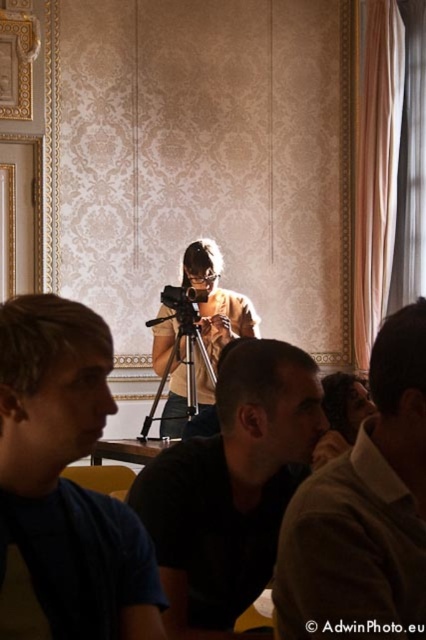
This screenshot has width=426, height=640. Find the location of `dark brown leather jacket at center`. dark brown leather jacket at center is located at coordinates (365, 512).

Does dark brown leather jacket at center lie in front of black plastic video camera at center?

Yes, dark brown leather jacket at center is in front of black plastic video camera at center.

This screenshot has width=426, height=640. Describe the element at coordinates (365, 512) in the screenshot. I see `dark brown leather jacket at center` at that location.

Find the location of a particular element. dark brown leather jacket at center is located at coordinates (365, 512).

Between blue cotton shirt at lower left and dark brown leather jacket at center, which one appears on the left side from the viewer's perspective?

blue cotton shirt at lower left is more to the left.

Is point (40, 376) less distant than point (396, 483)?

No, it is behind (396, 483).

The image size is (426, 640). I want to click on blue cotton shirt at lower left, so click(68, 480).

Can you confirm if dark brown leather jacket at center is thinner than matte yellow shirt at center?

Incorrect, dark brown leather jacket at center's width is not less than matte yellow shirt at center's.

Is dark brown leather jacket at center to the left of matte yellow shirt at center from the viewer's perspective?

No, dark brown leather jacket at center is not to the left of matte yellow shirt at center.

Image resolution: width=426 pixels, height=640 pixels. I want to click on dark brown leather jacket at center, so click(x=365, y=512).